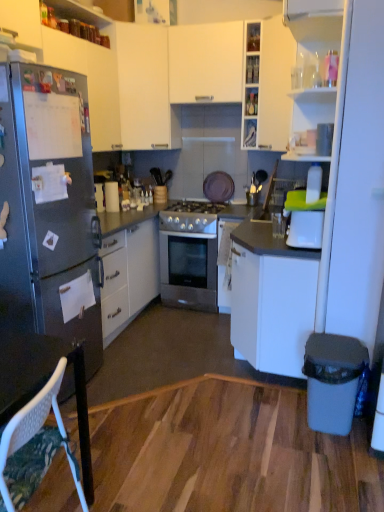
Question: Is clear glass bottles at upper center, which ranks as the second shelf in bottom-to-top order, taller or shorter than white plastic trash can at lower right?

Choices:
 (A) short
 (B) tall

Answer: (A)

Question: From the image's perspective, is clear glass bottles at upper center, the 1th shelf positioned from the top, above or below white plastic trash can at lower right?

Choices:
 (A) below
 (B) above

Answer: (B)

Question: Estimate the real-world distances between objects in this image. Which object is farther from the white matte cabinet at upper center, arranged as the 3th cabinetry when viewed from the left?

Choices:
 (A) white matte cabinet at upper center, placed as the second cabinetry when sorted from left to right
 (B) white matte cabinet at upper center, which is the 1th cabinetry in right-to-left order
 (C) clear glass shelf at upper center, marked as the second shelf in a top-to-bottom arrangement
 (D) white mesh chair at lower left
 (E) clear glass bottles at upper center, which ranks as the second shelf in bottom-to-top order

Answer: (D)

Question: Which of these objects is positioned farthest from the clear glass shelf at upper center, the 1th shelf from the bottom?

Choices:
 (A) clear glass bottles at upper center, which ranks as the second shelf in bottom-to-top order
 (B) white matte cabinet at upper center, which appears as the second cabinetry when viewed from the right
 (C) black matte oven at center
 (D) white matte cabinet at upper center, which is counted as the 4th cabinetry, starting from the left
 (E) white plastic trash can at lower right

Answer: (E)